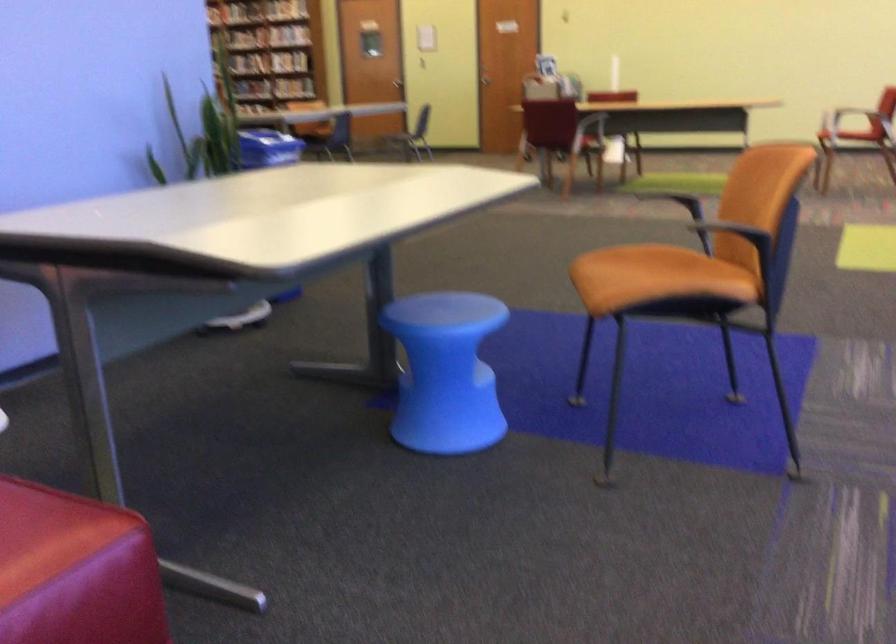
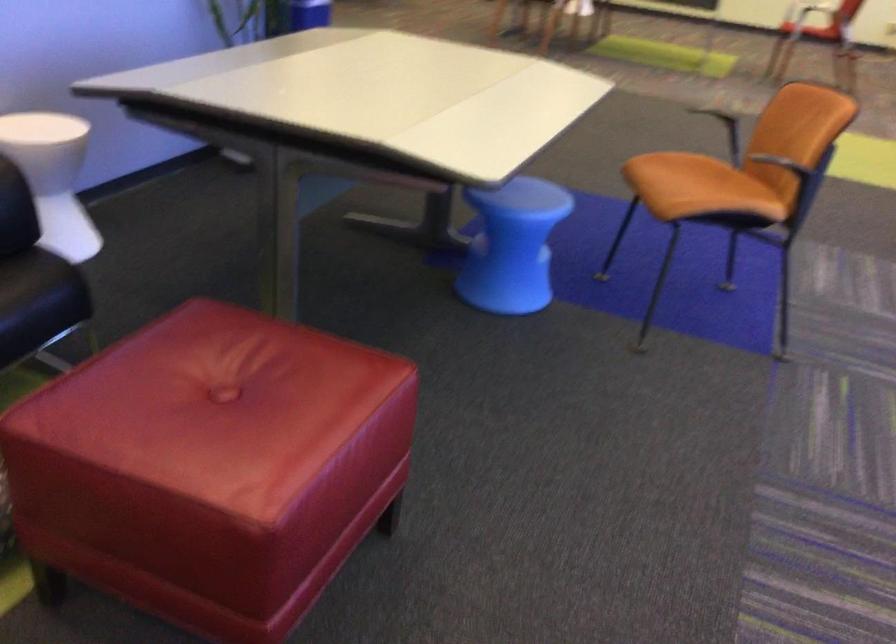
The point at (x=434, y=373) is marked in the first image. Where is the corresponding point in the second image?

(512, 245)